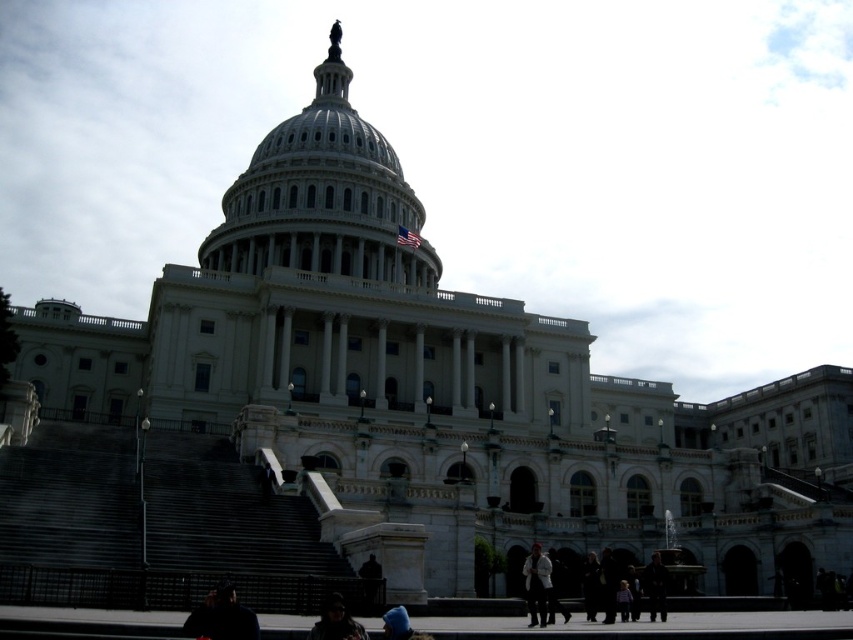
You are standing at the base of the United States Capitol Building and see both the light gray fabric jacket at lower center and the matte black jacket at lower center. If you want to reach both jackets in the shortest distance possible, which jacket should you approach first?

The light gray fabric jacket at lower center is 15.09 meters away from the matte black jacket at lower center. To reach both jackets in the shortest distance possible, you should approach the closer one first. However, since both jackets are at the same location at lower center, the distance between them is minimal, so you can reach either one first without significant difference in distance.

Based on the photo, you are a photographer planning to take a picture of the white marble dome at center and the dark fabric jacket at lower left. You want to ensure both are in the frame. Given that the camera has a fixed focal length, which object should you position closer to the center of the frame to include both without cropping?

The white marble dome at center is wider than the dark fabric jacket at lower left. To include both without cropping, position the white marble dome at center closer to the center of the frame since it is larger and requires more space.

You are a photographer standing at the base of the United States Capitol Building, aiming to capture a shot of the American flag flying at half mast near the dome. You notice a light gray fabric jacket at lower center in your frame. To ensure the jacket doesn not appear in your final photo, where should you adjust your camera? Specify the direction relative to the current position.

To avoid the light gray fabric jacket at lower center, you should move your camera upwards since the jacket is located at the lower part of the frame.